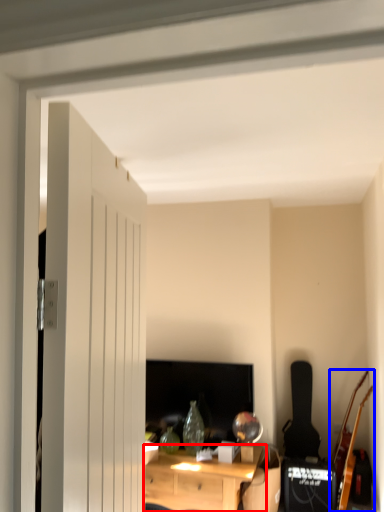
Question: Which object appears closest to the camera in this image, desk (highlighted by a red box) or guitar (highlighted by a blue box)?

Choices:
 (A) desk
 (B) guitar

Answer: (A)